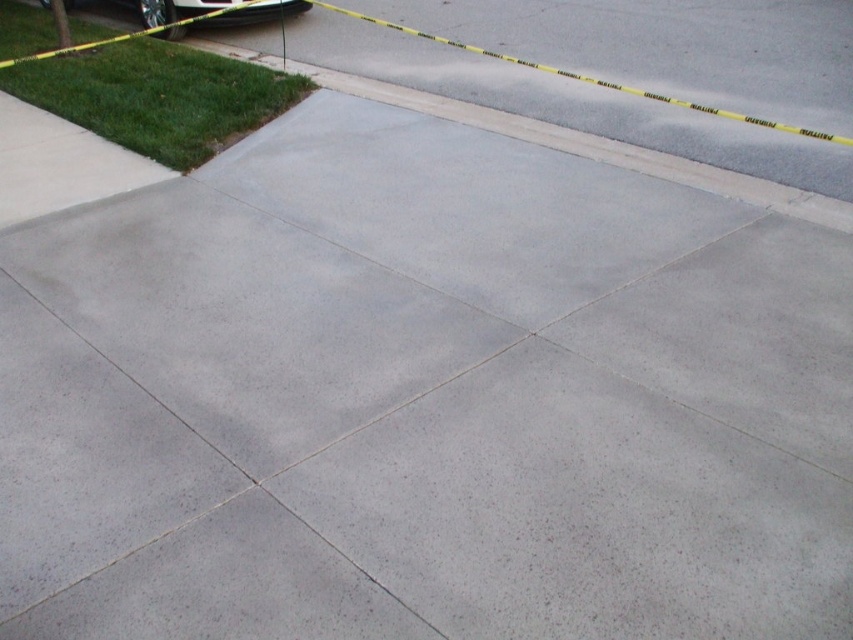
You are a construction worker assessing the driveway. You see the gray concrete curb at upper left and the shiny black car at upper left. Which object is wider?

The gray concrete curb at upper left might be wider than the shiny black car at upper left according to the description.

You are a delivery person approaching the gray concrete curb at upper left and the shiny black car at upper left. Which object is closer to you as you arrive?

The gray concrete curb at upper left is closer to you because it is positioned in front of the shiny black car at upper left.